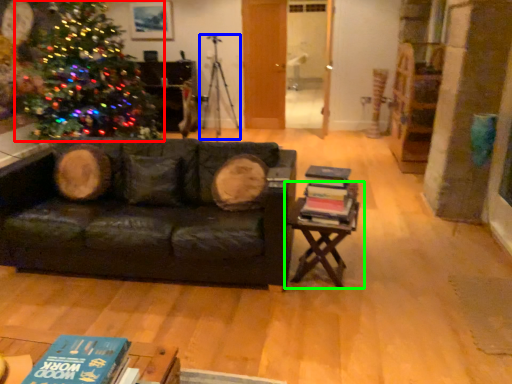
Question: Which is nearer to the christmas tree (highlighted by a red box)? tripod (highlighted by a blue box) or table (highlighted by a green box).

Choices:
 (A) tripod
 (B) table

Answer: (A)